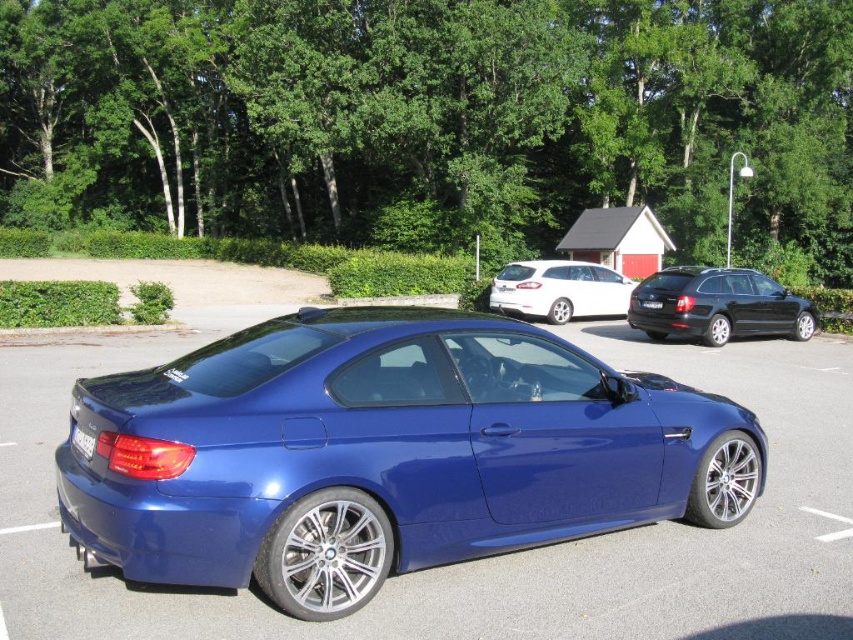
In the scene shown: You are a parking attendant checking license plate sizes. The black plastic license plate at rear is on the BMW sports car. The blue metallic license plate at center is on the white station wagon. Which license plate is smaller?

The black plastic license plate at rear is smaller than the blue metallic license plate at center according to the description.

You are a parking attendant checking license plates. You see the black plastic license plate at rear and the blue metallic license plate at center. Which license plate is positioned lower on the car?

The black plastic license plate at rear is located below the blue metallic license plate at center, so it is positioned lower on the car.

You are a parking attendant and need to direct a driver to the black plastic license plate at rear. Based on the scene, which direction should the driver turn to locate the black metallic wagon at right relative to the license plate?

The black metallic wagon at right is to the right of the black plastic license plate at rear, so the driver should turn right to locate the wagon relative to the license plate.